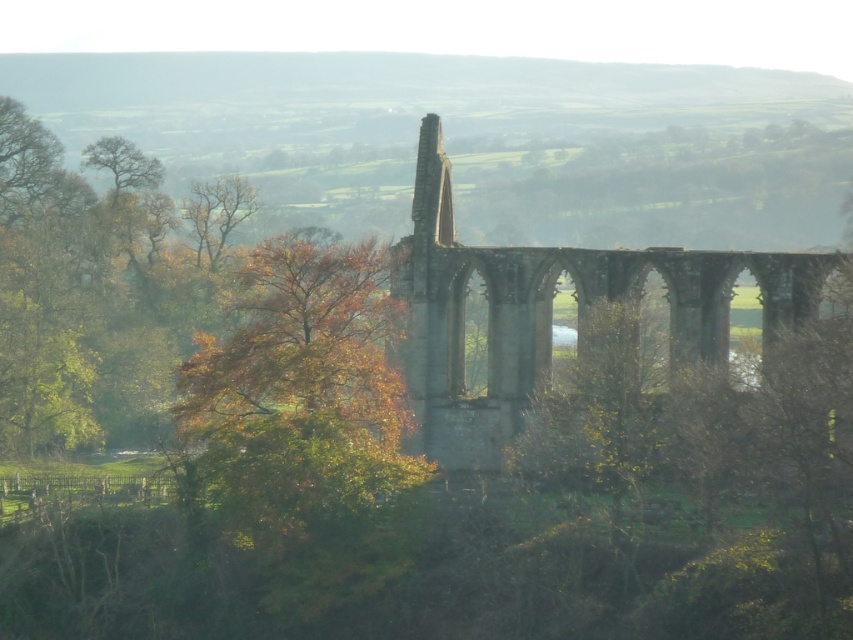
Question: Which point appears closest to the camera in this image?

Choices:
 (A) (264, 296)
 (B) (593, 282)

Answer: (A)

Question: Which point is farther to the camera?

Choices:
 (A) (776, 312)
 (B) (271, 381)

Answer: (A)

Question: Is autumn leaves at left closer to camera compared to stone arches at center?

Choices:
 (A) no
 (B) yes

Answer: (B)

Question: Does autumn leaves at left appear under stone arches at center?

Choices:
 (A) no
 (B) yes

Answer: (B)

Question: Considering the relative positions of autumn leaves at left and stone arches at center in the image provided, where is autumn leaves at left located with respect to stone arches at center?

Choices:
 (A) right
 (B) left

Answer: (B)